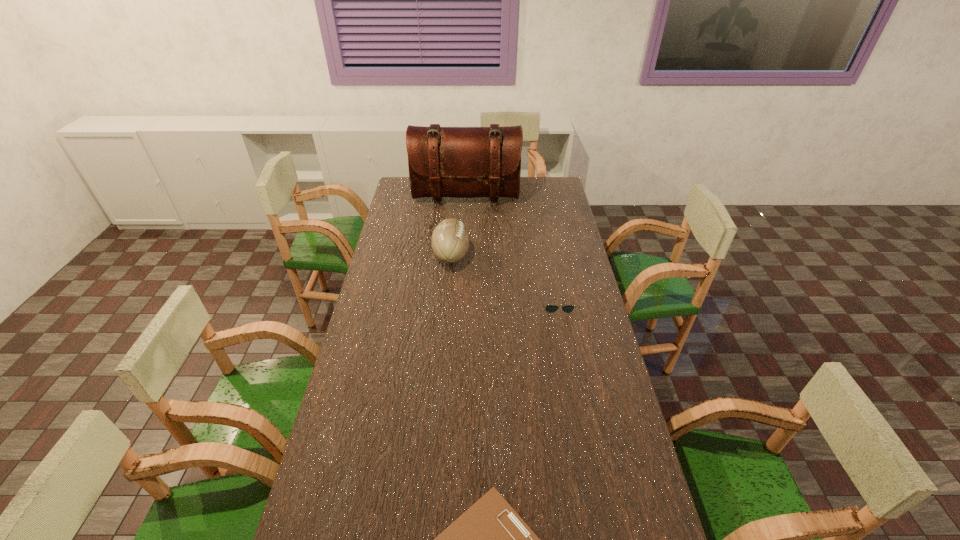
The width and height of the screenshot is (960, 540). What are the coordinates of `the farthest object` in the screenshot? It's located at (461, 162).

At what (x,y) coordinates should I click in order to perform the action: click on the tallest object. Please return your answer as a coordinate pair (x, y). Looking at the image, I should click on (461, 162).

Locate an element on the screen. the third nearest object is located at coordinates (450, 240).

Where is `football (American)`? football (American) is located at coordinates (450, 240).

Locate an element on the screen. The image size is (960, 540). sunglasses is located at coordinates (549, 308).

Locate an element on the screen. the rightmost object is located at coordinates (549, 308).

The image size is (960, 540). What are the coordinates of `vacant space situated on the front-facing side of the tallest object` in the screenshot? It's located at (465, 217).

The image size is (960, 540). In order to click on free space located on the laces of the football (American) in this screenshot , I will do `click(503, 255)`.

Locate an element on the screen. Image resolution: width=960 pixels, height=540 pixels. vacant area located 0.220m on the lenses of the rightmost object is located at coordinates (568, 361).

This screenshot has height=540, width=960. I want to click on object situated at the far edge, so click(461, 162).